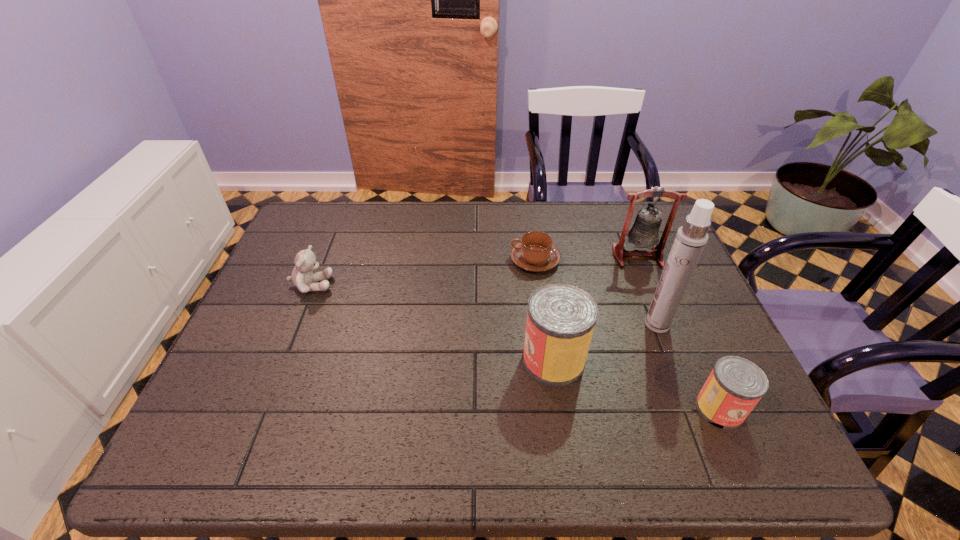
I want to click on free space located on the back of the shorter can, so click(677, 312).

This screenshot has width=960, height=540. I want to click on vacant space situated 0.130m on the back of the second tallest object, so click(623, 220).

Where is `free location located on the face of the teddy bear`? free location located on the face of the teddy bear is located at coordinates (366, 285).

What are the coordinates of `free space located on the side of the shortest object with the handle` in the screenshot? It's located at (421, 260).

Locate an element on the screen. The image size is (960, 540). vacant space positioned 0.060m on the side of the shortest object with the handle is located at coordinates (490, 260).

The height and width of the screenshot is (540, 960). I want to click on vacant space situated on the side of the shortest object with the handle, so click(428, 260).

I want to click on vacant position located 0.250m on the left of the aerosol can, so click(545, 325).

The width and height of the screenshot is (960, 540). Identify the location of bell at the far edge. (644, 233).

Where is `cappuccino located at the far edge`? cappuccino located at the far edge is located at coordinates (535, 252).

Where is `object at the left edge`? object at the left edge is located at coordinates (303, 278).